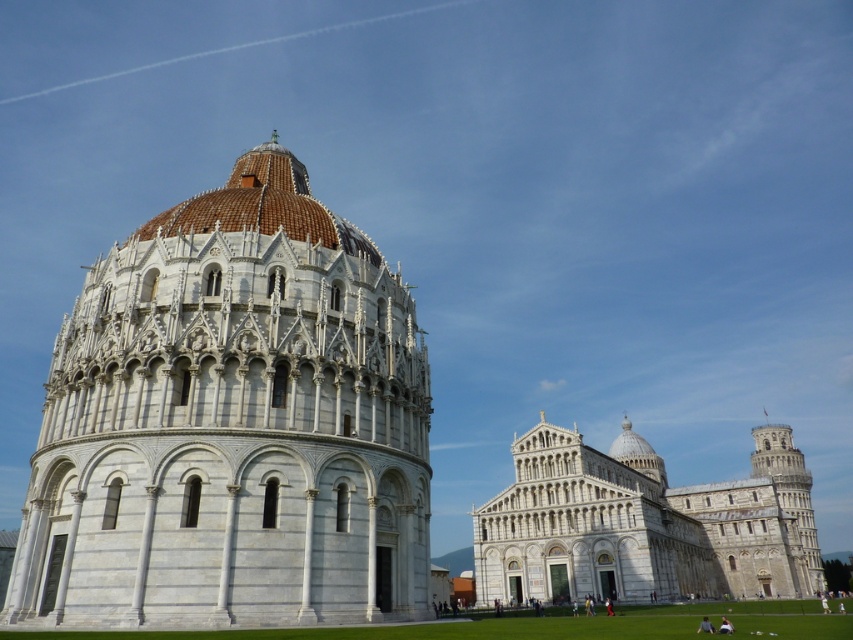
Question: Among these points, which one is nearest to the camera?

Choices:
 (A) (114, 560)
 (B) (584, 460)

Answer: (A)

Question: Does white marble tower at center have a greater width compared to white stone cathedral at center?

Choices:
 (A) no
 (B) yes

Answer: (B)

Question: Does white marble tower at center have a smaller size compared to white stone cathedral at center?

Choices:
 (A) yes
 (B) no

Answer: (B)

Question: Which object appears farthest from the camera in this image?

Choices:
 (A) white marble tower at center
 (B) white stone cathedral at center

Answer: (B)

Question: Where is white marble tower at center located in relation to white stone cathedral at center in the image?

Choices:
 (A) right
 (B) left

Answer: (B)